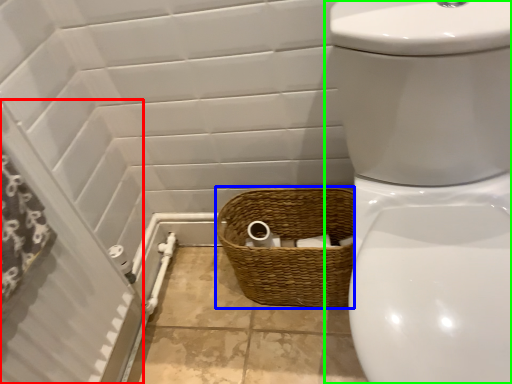
Question: Estimate the real-world distances between objects in this image. Which object is farther from screen door (highlighted by a red box), basket (highlighted by a blue box) or toilet (highlighted by a green box)?

Choices:
 (A) basket
 (B) toilet

Answer: (B)